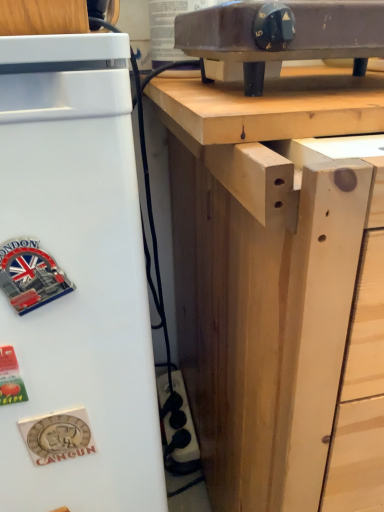
Question: Does matte black electric stove at upper center have a greater height compared to natural wood table at upper center?

Choices:
 (A) no
 (B) yes

Answer: (B)

Question: Is matte black electric stove at upper center shorter than natural wood table at upper center?

Choices:
 (A) no
 (B) yes

Answer: (A)

Question: Is matte black electric stove at upper center behind natural wood table at upper center?

Choices:
 (A) no
 (B) yes

Answer: (B)

Question: Is matte black electric stove at upper center to the right of natural wood table at upper center from the viewer's perspective?

Choices:
 (A) no
 (B) yes

Answer: (B)

Question: From a real-world perspective, is matte black electric stove at upper center below natural wood table at upper center?

Choices:
 (A) no
 (B) yes

Answer: (A)

Question: From the image's perspective, is matte black electric stove at upper center located above natural wood table at upper center?

Choices:
 (A) no
 (B) yes

Answer: (B)

Question: Does white matte refrigerator at left have a greater width compared to natural wood table at upper center?

Choices:
 (A) yes
 (B) no

Answer: (B)

Question: Is white matte refrigerator at left smaller than natural wood table at upper center?

Choices:
 (A) no
 (B) yes

Answer: (A)

Question: Is white matte refrigerator at left thinner than natural wood table at upper center?

Choices:
 (A) no
 (B) yes

Answer: (B)

Question: Is white matte refrigerator at left shorter than natural wood table at upper center?

Choices:
 (A) yes
 (B) no

Answer: (B)

Question: From a real-world perspective, is white matte refrigerator at left located higher than natural wood table at upper center?

Choices:
 (A) yes
 (B) no

Answer: (B)

Question: Is white matte refrigerator at left bigger than natural wood table at upper center?

Choices:
 (A) yes
 (B) no

Answer: (A)

Question: Can you confirm if natural wood table at upper center is thinner than natural wood desk at upper center?

Choices:
 (A) no
 (B) yes

Answer: (B)